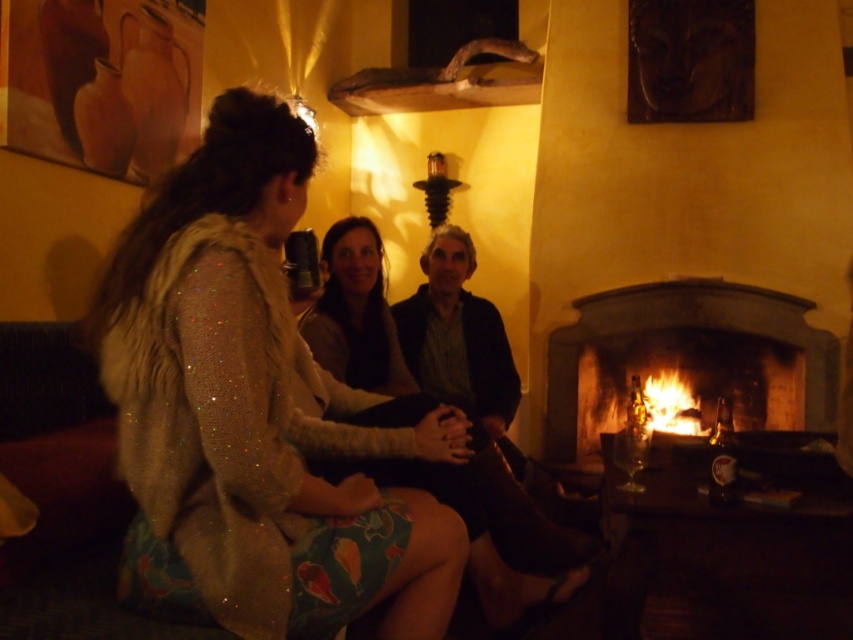
Question: Is the position of wooden fireplace at right more distant than that of matte beige sweater at center?

Choices:
 (A) yes
 (B) no

Answer: (A)

Question: Which point is farther to the camera?

Choices:
 (A) matte black sweater at center
 (B) sparkly beige sweater at center
 (C) dark brown leather jacket at center
 (D) flaming wood at right

Answer: (D)

Question: Which is nearer to the sparkly beige sweater at center?

Choices:
 (A) matte black sweater at center
 (B) flaming wood at right
 (C) dark brown leather jacket at center
 (D) matte beige sweater at center

Answer: (D)

Question: Which point is closer to the camera taking this photo?

Choices:
 (A) (631, 348)
 (B) (410, 541)
 (C) (476, 307)
 (D) (360, 358)

Answer: (B)

Question: Can you confirm if wooden fireplace at right is positioned to the left of dark brown leather jacket at center?

Choices:
 (A) no
 (B) yes

Answer: (A)

Question: Does sparkly beige sweater at center have a greater width compared to matte beige sweater at center?

Choices:
 (A) yes
 (B) no

Answer: (B)